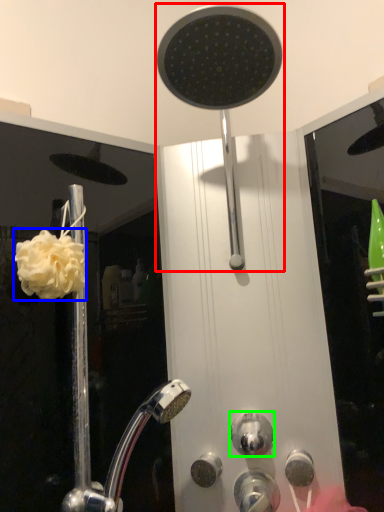
Question: Which object is the closest to the shower (highlighted by a red box)? Choose among these: flower (highlighted by a blue box) or knob (highlighted by a green box).

Choices:
 (A) flower
 (B) knob

Answer: (A)